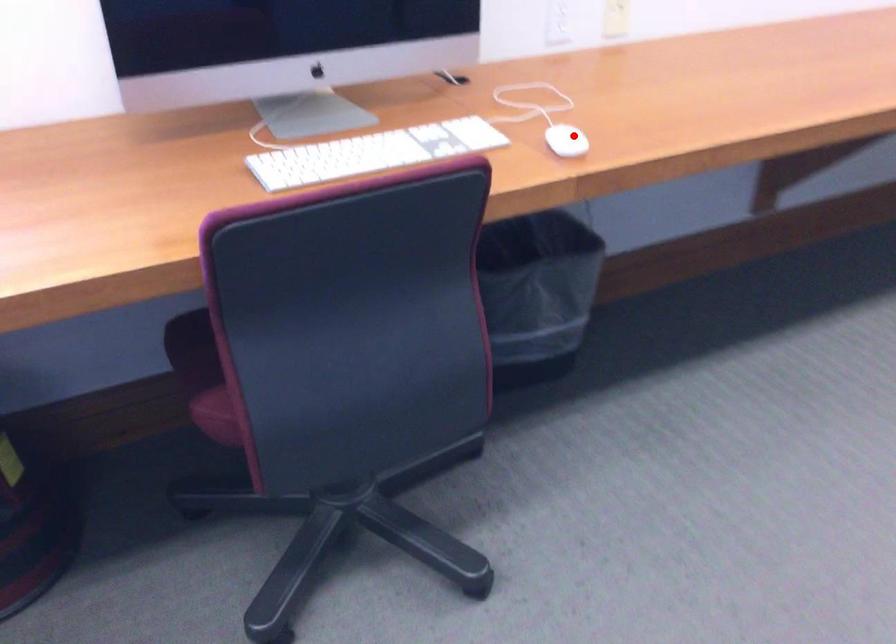
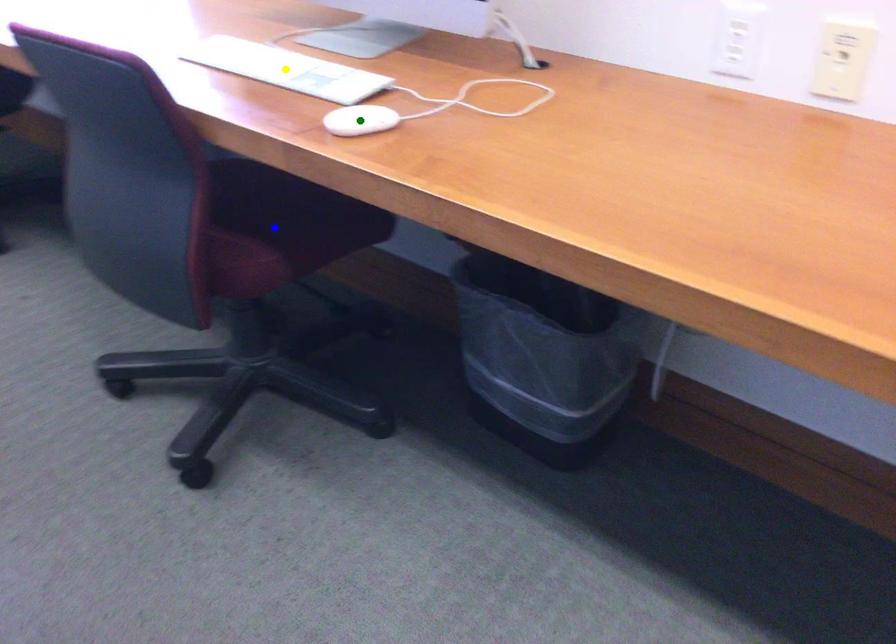
Question: I am providing you with two images of the same scene from different viewpoints. A red point is marked on the first image. You are given multiple points on the second image. Can you choose the point in image 2 that corresponds to the point in image 1?

Choices:
 (A) yellow point
 (B) green point
 (C) blue point

Answer: (B)